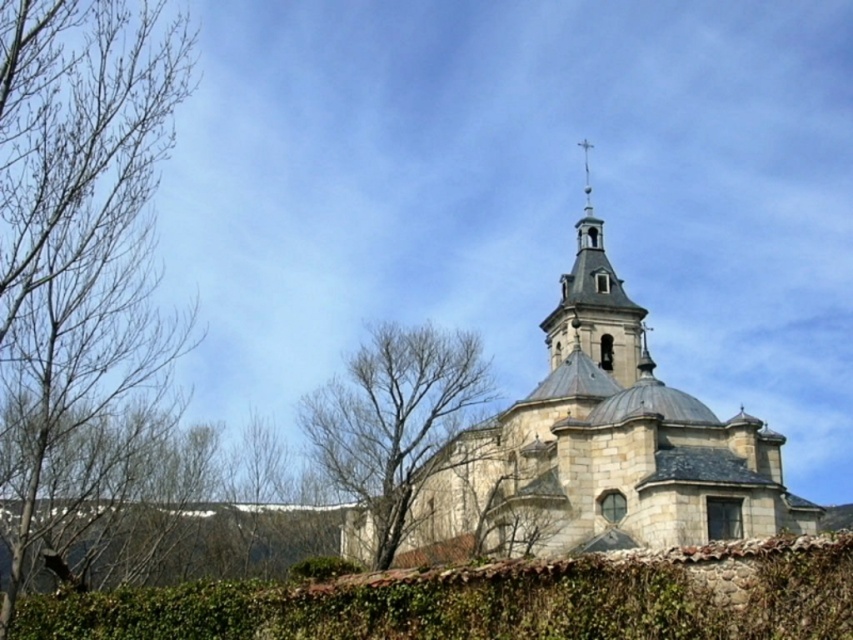
You are standing in front of the historic stone church and want to take a photo of the bell tower. The bare branches at left are blocking your view. Can you move to the right side of the green ivy hedge at lower center to get a clear shot of the bell tower?

The green ivy hedge at lower center is behind the bare branches at left, so moving to the right side of the green ivy hedge at lower center might still leave the bare branches at left in front, potentially blocking the view of the bell tower.

You are an architect analyzing the spatial layout of the church. Based on the image, which object occupies more horizontal space in the scene? Please refer to the bare branches at left and the green ivy hedge at lower center in your analysis.

The green ivy hedge at lower center occupies more horizontal space than the bare branches at left since the bare branches at left has a lesser width compared to green ivy hedge at lower center.